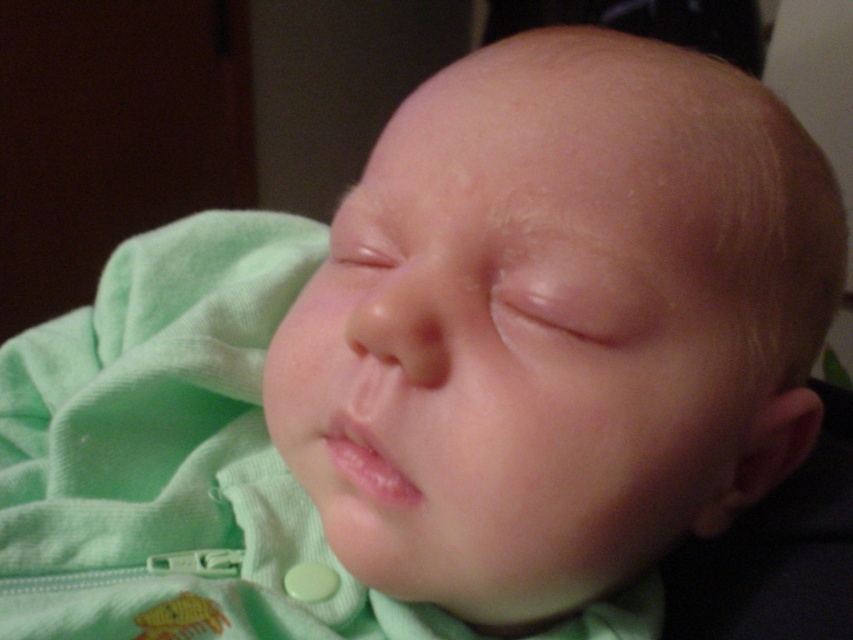
Between smooth green baby at center and green soft fabric at center, which one appears on the right side from the viewer's perspective?

Positioned to the right is smooth green baby at center.

Does point (703, 417) lie in front of point (181, 273)?

Yes, it is in front of point (181, 273).

What do you see at coordinates (561, 321) in the screenshot? This screenshot has height=640, width=853. I see `smooth green baby at center` at bounding box center [561, 321].

The width and height of the screenshot is (853, 640). Find the location of `smooth green baby at center`. smooth green baby at center is located at coordinates (561, 321).

Does green soft fabric at center appear on the right side of clear plastic teething ring at lower center?

In fact, green soft fabric at center is to the left of clear plastic teething ring at lower center.

This screenshot has width=853, height=640. What are the coordinates of `green soft fabric at center` in the screenshot? It's located at (171, 456).

Which is more to the right, smooth green baby at center or clear plastic teething ring at lower center?

smooth green baby at center is more to the right.

Can you confirm if smooth green baby at center is smaller than clear plastic teething ring at lower center?

Actually, smooth green baby at center might be larger than clear plastic teething ring at lower center.

Is point (607, 548) farther from camera compared to point (363, 492)?

That is True.

The height and width of the screenshot is (640, 853). I want to click on smooth green baby at center, so click(561, 321).